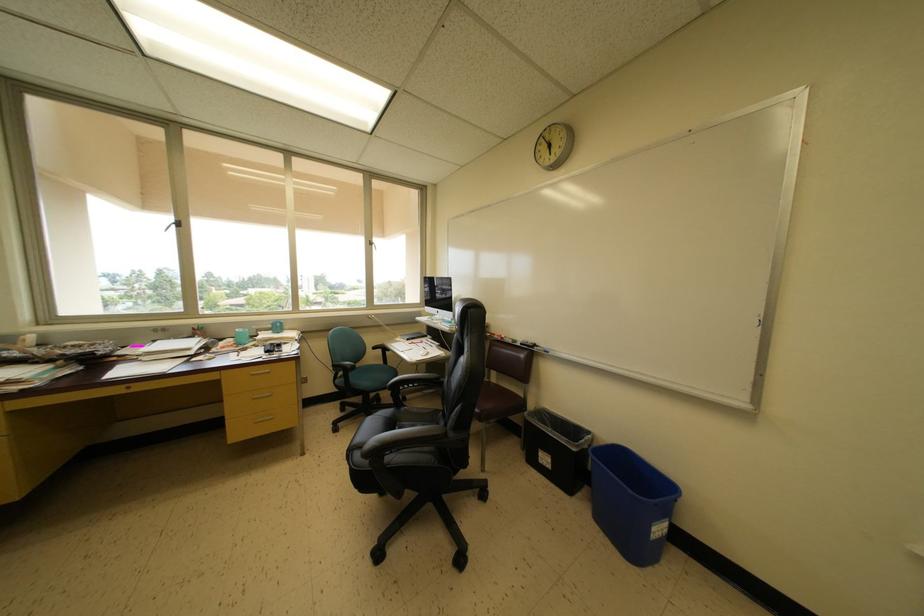
Where is `black trash can`? black trash can is located at coordinates (527, 562).